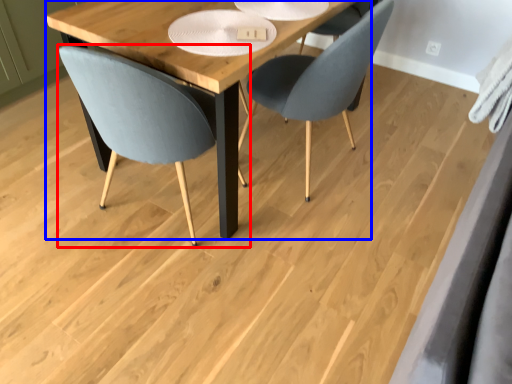
Question: Among these objects, which one is farthest to the camera, chair (highlighted by a red box) or table (highlighted by a blue box)?

Choices:
 (A) chair
 (B) table

Answer: (B)